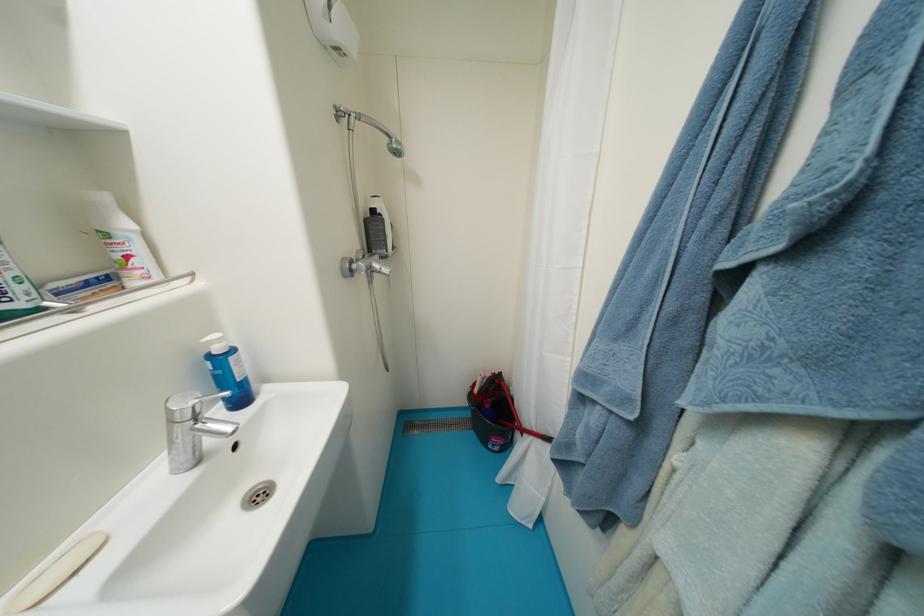
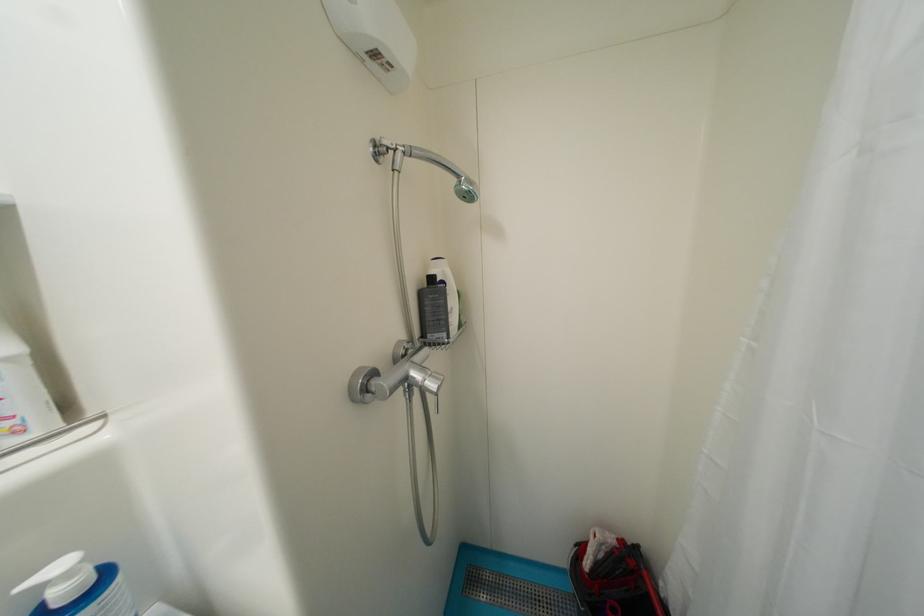
In the second image, find the point that corresponds to point 380,214 in the first image.

(439, 281)